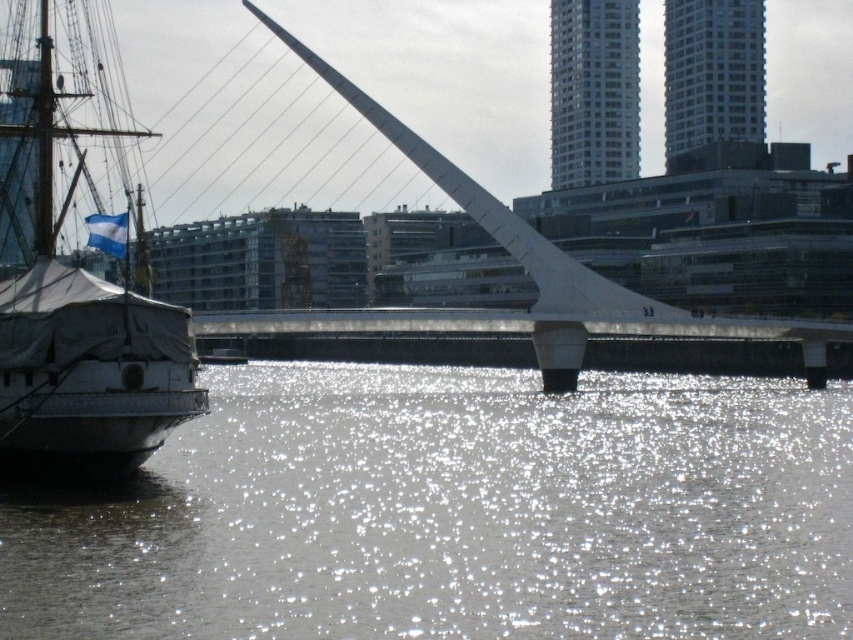
Question: Is sparkling silver water at center thinner than white canvas sailboat at left?

Choices:
 (A) no
 (B) yes

Answer: (A)

Question: Which point is farther from the camera taking this photo?

Choices:
 (A) (48, 250)
 (B) (519, 410)

Answer: (B)

Question: Is the position of sparkling silver water at center more distant than that of white canvas sailboat at left?

Choices:
 (A) no
 (B) yes

Answer: (A)

Question: Can you confirm if sparkling silver water at center is thinner than white canvas sailboat at left?

Choices:
 (A) yes
 (B) no

Answer: (B)

Question: Which point is farther from the camera taking this photo?

Choices:
 (A) (235, 464)
 (B) (77, 163)

Answer: (B)

Question: Which object is closer to the camera taking this photo?

Choices:
 (A) white canvas sailboat at left
 (B) sparkling silver water at center

Answer: (B)